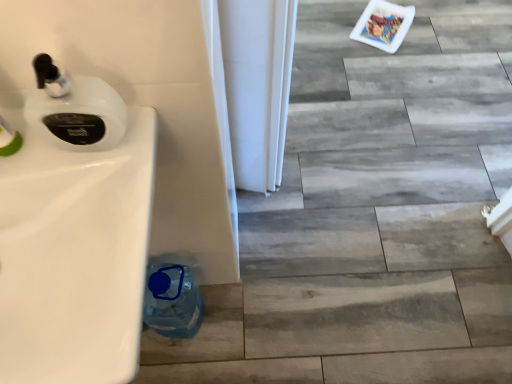
Question: From their relative heights in the image, would you say blue plastic bottle at lower left is taller or shorter than white glossy sink at left?

Choices:
 (A) tall
 (B) short

Answer: (A)

Question: Relative to white glossy sink at left, is blue plastic bottle at lower left in front or behind?

Choices:
 (A) front
 (B) behind

Answer: (B)

Question: Which of these objects is positioned farthest from the white glossy sink at left?

Choices:
 (A) white glossy soap dispenser at upper left
 (B) blue plastic bottle at lower left

Answer: (B)

Question: Estimate the real-world distances between objects in this image. Which object is farther from the white glossy sink at left?

Choices:
 (A) white glossy soap dispenser at upper left
 (B) blue plastic bottle at lower left

Answer: (B)